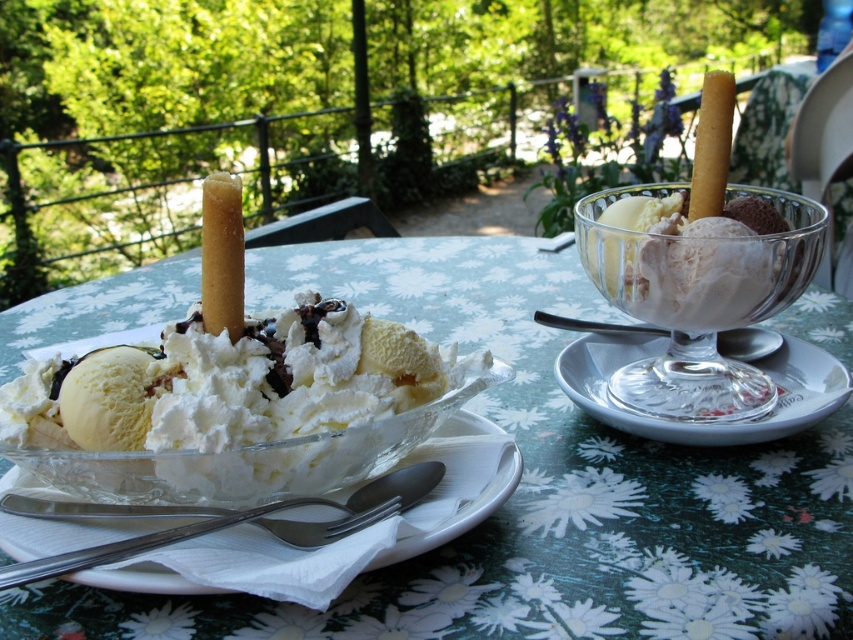
Does clear glass bowl at center appear on the right side of white glass saucer at right?

Incorrect, clear glass bowl at center is not on the right side of white glass saucer at right.

In the scene shown: Does clear glass bowl at center come in front of white glass saucer at right?

Yes.

Locate an element on the screen. The image size is (853, 640). clear glass bowl at center is located at coordinates (540, 492).

Does clear glass bowl at center have a larger size compared to white porcelain plate at center?

Correct, clear glass bowl at center is larger in size than white porcelain plate at center.

Can you confirm if clear glass bowl at center is taller than white porcelain plate at center?

Correct, clear glass bowl at center is much taller as white porcelain plate at center.

Based on the photo, who is more distant from viewer, (117,620) or (416,552)?

Positioned behind is point (416,552).

Where is `clear glass bowl at center`? The height and width of the screenshot is (640, 853). clear glass bowl at center is located at coordinates (540, 492).

Is point (590, 508) positioned before point (102, 422)?

No.

The width and height of the screenshot is (853, 640). What do you see at coordinates (540, 492) in the screenshot?
I see `clear glass bowl at center` at bounding box center [540, 492].

Does point (587, 524) come behind point (389, 440)?

Yes.

You are a GUI agent. You are given a task and a screenshot of the screen. Output one action in this format:
    pyautogui.click(x=<x>, y=<y>)
    Task: Click on the clear glass bowl at center
    The image size is (853, 640).
    Given the screenshot: What is the action you would take?
    pyautogui.click(x=540, y=492)